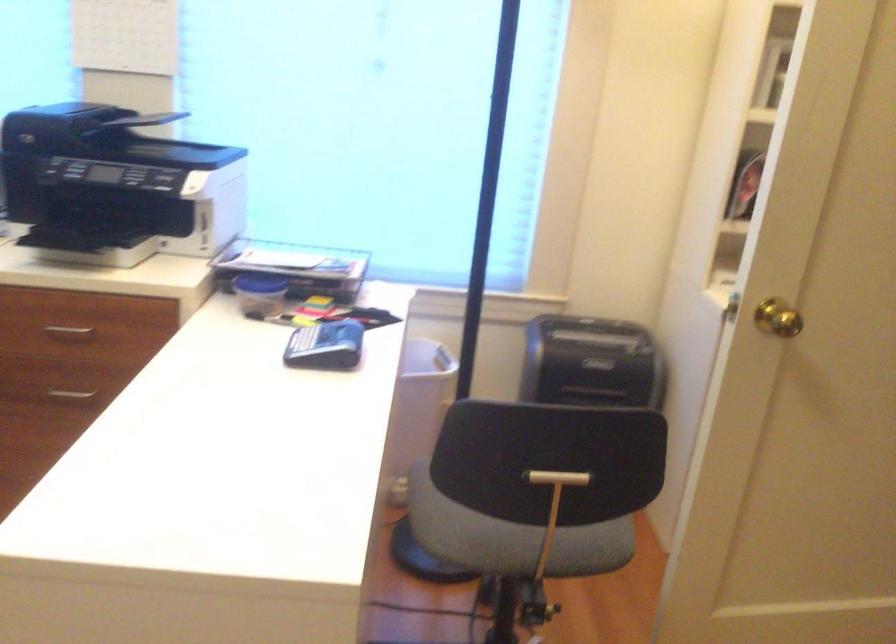
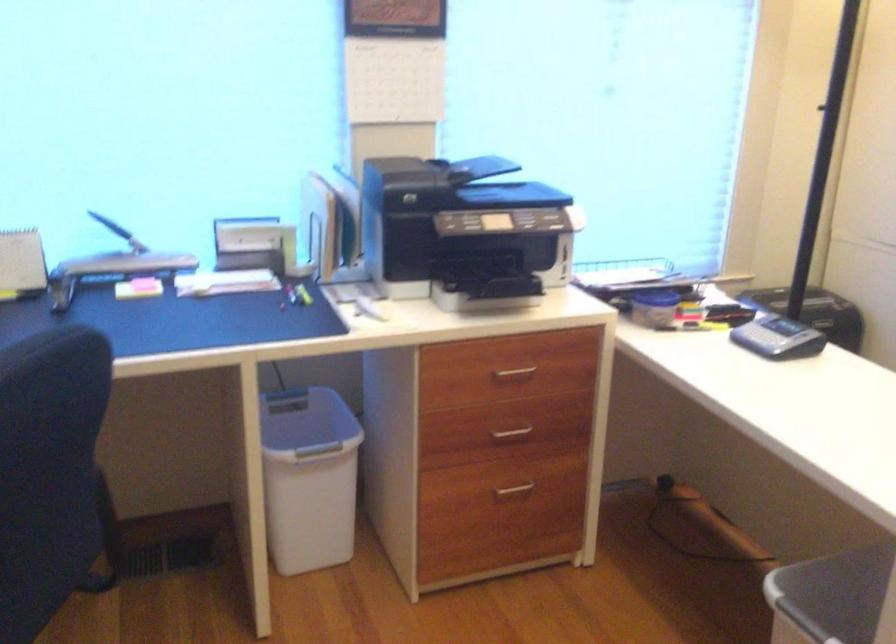
The point at (80, 395) is marked in the first image. Where is the corresponding point in the second image?

(511, 433)